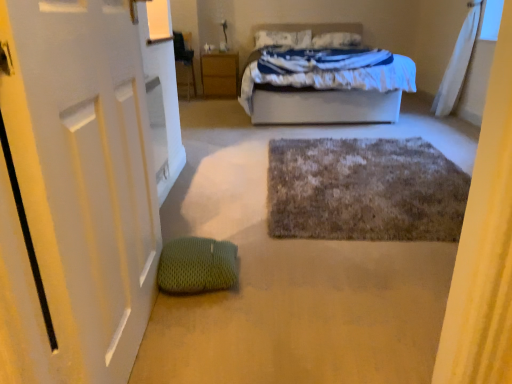
Image resolution: width=512 pixels, height=384 pixels. Identify the location of free space that is to the left of white sheer curtain at upper right. [416, 122].